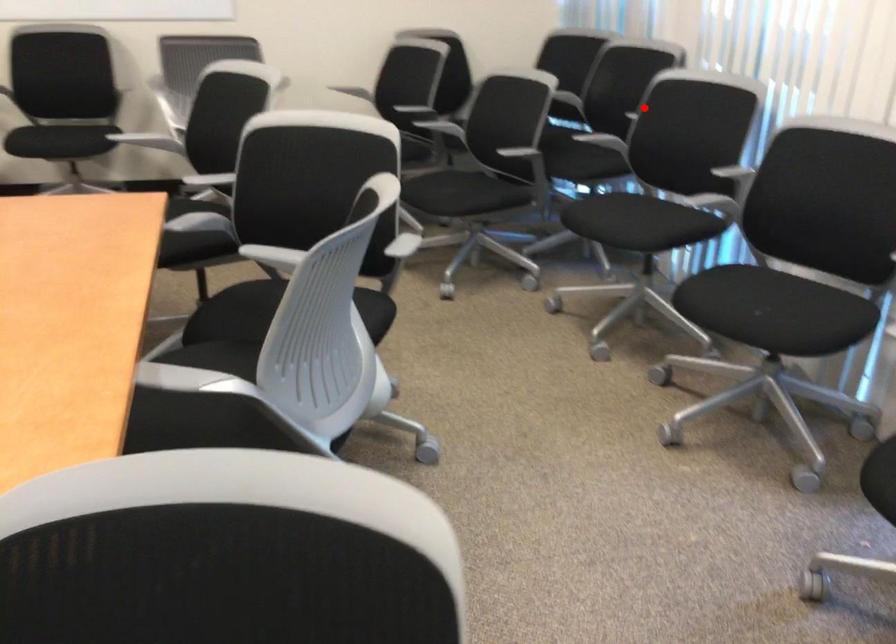
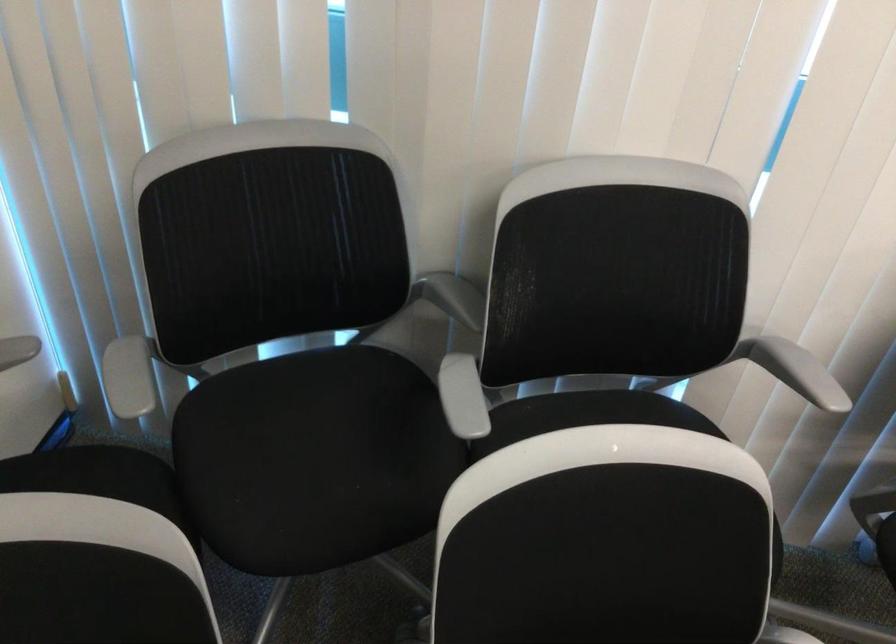
Question: I am providing you with two images of the same scene from different viewpoints. In image1, a red point is highlighted. Considering the same 3D point in image2, which of the following is correct?

Choices:
 (A) It is closer
 (B) It is farther

Answer: (A)